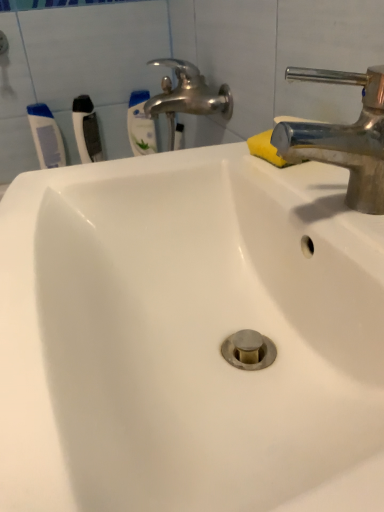
Question: In terms of height, does polished chrome tap at upper right look taller or shorter compared to white plastic toothbrush at upper left, the second toothbrush from the left?

Choices:
 (A) short
 (B) tall

Answer: (A)

Question: Do you think polished chrome tap at upper right is within white plastic toothbrush at upper left, the second toothbrush from the left, or outside of it?

Choices:
 (A) inside
 (B) outside

Answer: (B)

Question: Considering the real-world distances, which object is farthest from the yellow sponge at upper right?

Choices:
 (A) white plastic toothbrush at upper left, acting as the first toothbrush starting from the left
 (B) white plastic toothbrush at upper left, the second toothbrush from the left
 (C) white plastic toothbrush at upper left, which is the third toothbrush from left to right
 (D) polished chrome tap at upper right

Answer: (A)

Question: Estimate the real-world distances between objects in this image. Which object is closer to the yellow sponge at upper right?

Choices:
 (A) white plastic toothbrush at upper left, which ranks as the 1th toothbrush in right-to-left order
 (B) polished chrome tap at upper right
 (C) white plastic toothbrush at upper left, acting as the second toothbrush starting from the right
 (D) white plastic toothbrush at upper left, acting as the first toothbrush starting from the left

Answer: (B)